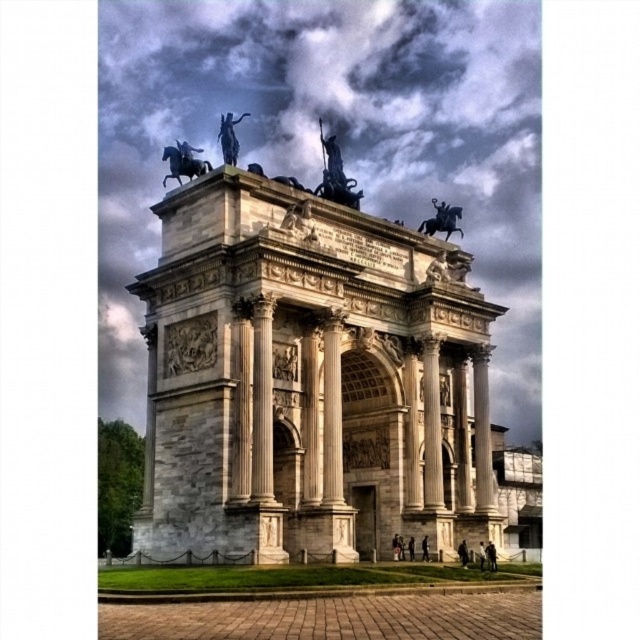
Question: Is the position of polished bronze statue at center less distant than that of shiny black horse at upper center?

Choices:
 (A) yes
 (B) no

Answer: (B)

Question: Which is nearer to the polished bronze horseman at upper right?

Choices:
 (A) white marble arch at center
 (B) shiny black horse at upper center

Answer: (A)

Question: Is white marble arch at center above polished bronze statue at center?

Choices:
 (A) no
 (B) yes

Answer: (A)

Question: Among these objects, which one is nearest to the camera?

Choices:
 (A) white marble arch at center
 (B) shiny black horse at upper center
 (C) polished bronze statue at center
 (D) polished bronze horseman at upper right

Answer: (A)

Question: Can you confirm if white marble arch at center is smaller than polished bronze statue at upper center?

Choices:
 (A) no
 (B) yes

Answer: (A)

Question: Which point is farther from the camera taking this photo?

Choices:
 (A) (196, 168)
 (B) (429, 234)

Answer: (B)